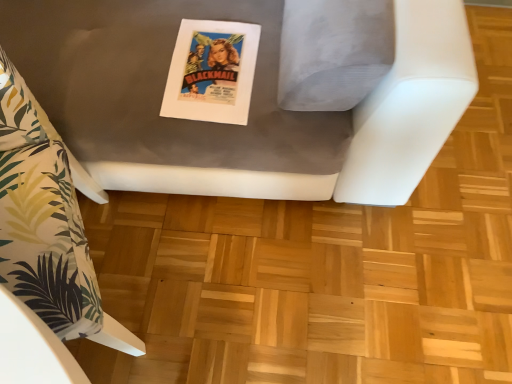
You are a GUI agent. You are given a task and a screenshot of the screen. Output one action in this format:
    pyautogui.click(x=<x>, y=<y>)
    Task: Click on the white fabric pillow at left, which is counted as the first furniture, starting from the left
    The width and height of the screenshot is (512, 384).
    Given the screenshot: What is the action you would take?
    pyautogui.click(x=44, y=250)

What do you see at coordinates (251, 102) in the screenshot?
I see `matte gray cushion at center, the 2th furniture in the left-to-right sequence` at bounding box center [251, 102].

What is the approximate width of matte gray cushion at center, which is counted as the 1th furniture, starting from the right?

matte gray cushion at center, which is counted as the 1th furniture, starting from the right, is 4.96 feet in width.

The width and height of the screenshot is (512, 384). I want to click on white fabric pillow at left, which is counted as the first furniture, starting from the left, so click(44, 250).

Would you say white fabric pillow at left, which is counted as the first furniture, starting from the left, is inside or outside matte gray cushion at center, the 2th furniture in the left-to-right sequence?

white fabric pillow at left, which is counted as the first furniture, starting from the left, fits inside matte gray cushion at center, the 2th furniture in the left-to-right sequence.

From the picture: Which of these two, white fabric pillow at left, which is counted as the first furniture, starting from the left, or matte gray cushion at center, the 2th furniture in the left-to-right sequence, is wider?

matte gray cushion at center, the 2th furniture in the left-to-right sequence.

From the image's perspective, which one is positioned higher, white fabric pillow at left, the second furniture from the right, or matte gray cushion at center, which is counted as the 1th furniture, starting from the right?

matte gray cushion at center, which is counted as the 1th furniture, starting from the right, appears higher in the image.

Which is more to the left, white fabric pillow at left, which is counted as the first furniture, starting from the left, or matte gray cushion at center, the 2th furniture in the left-to-right sequence?

white fabric pillow at left, which is counted as the first furniture, starting from the left.

Is white fabric pillow at left, which is counted as the first furniture, starting from the left, surrounded by matte gray cushion at center, the 2th furniture in the left-to-right sequence?

Yes, white fabric pillow at left, which is counted as the first furniture, starting from the left, is a part of matte gray cushion at center, the 2th furniture in the left-to-right sequence.

Considering the sizes of matte gray cushion at center, which is counted as the 1th furniture, starting from the right, and white fabric pillow at left, the second furniture from the right, in the image, is matte gray cushion at center, which is counted as the 1th furniture, starting from the right, wider or thinner than white fabric pillow at left, the second furniture from the right,?

Clearly, matte gray cushion at center, which is counted as the 1th furniture, starting from the right, has more width compared to white fabric pillow at left, the second furniture from the right.

How many degrees apart are the facing directions of matte gray cushion at center, the 2th furniture in the left-to-right sequence, and white fabric pillow at left, which is counted as the first furniture, starting from the left?

A: The angular difference between matte gray cushion at center, the 2th furniture in the left-to-right sequence, and white fabric pillow at left, which is counted as the first furniture, starting from the left, is 20.7 degrees.

Based on their positions, is matte gray cushion at center, the 2th furniture in the left-to-right sequence, located to the left or right of white fabric pillow at left, the second furniture from the right?

In the image, matte gray cushion at center, the 2th furniture in the left-to-right sequence, appears on the right side of white fabric pillow at left, the second furniture from the right.

Could you tell me if matte paper poster at center is turned towards white fabric pillow at left, which is counted as the first furniture, starting from the left?

No, matte paper poster at center is not aimed at white fabric pillow at left, which is counted as the first furniture, starting from the left.

Identify the location of the 1st furniture in front of the matte paper poster at center, starting your count from the anchor. The width and height of the screenshot is (512, 384). (44, 250).

How distant is matte paper poster at center from white fabric pillow at left, the second furniture from the right?

matte paper poster at center is 15.50 inches from white fabric pillow at left, the second furniture from the right.

Is matte paper poster at center located outside white fabric pillow at left, which is counted as the first furniture, starting from the left?

Yes, matte paper poster at center is not within white fabric pillow at left, which is counted as the first furniture, starting from the left.

Based on the photo, how different are the orientations of white fabric pillow at left, which is counted as the first furniture, starting from the left, and matte paper poster at center in degrees?

white fabric pillow at left, which is counted as the first furniture, starting from the left, and matte paper poster at center are facing 22.2 degrees away from each other.

Identify the location of comic book on the right of white fabric pillow at left, which is counted as the first furniture, starting from the left. The height and width of the screenshot is (384, 512). (212, 72).

From a real-world perspective, is white fabric pillow at left, which is counted as the first furniture, starting from the left, physically located above or below matte paper poster at center?

white fabric pillow at left, which is counted as the first furniture, starting from the left, is below matte paper poster at center.

I want to click on comic book behind the matte gray cushion at center, the 2th furniture in the left-to-right sequence, so click(212, 72).

Are matte gray cushion at center, which is counted as the 1th furniture, starting from the right, and matte paper poster at center located far from each other?

No.

Can you tell me how much matte gray cushion at center, which is counted as the 1th furniture, starting from the right, and matte paper poster at center differ in facing direction?

The facing directions of matte gray cushion at center, which is counted as the 1th furniture, starting from the right, and matte paper poster at center are 1.42 degrees apart.

From the picture: From the image's perspective, between matte gray cushion at center, which is counted as the 1th furniture, starting from the right, and matte paper poster at center, which one is located above?

matte gray cushion at center, which is counted as the 1th furniture, starting from the right, is shown above in the image.

Considering the positions of objects matte paper poster at center and matte gray cushion at center, which is counted as the 1th furniture, starting from the right, in the image provided, who is in front, matte paper poster at center or matte gray cushion at center, which is counted as the 1th furniture, starting from the right,?

matte gray cushion at center, which is counted as the 1th furniture, starting from the right, is in front.

Considering the sizes of objects matte paper poster at center and matte gray cushion at center, the 2th furniture in the left-to-right sequence, in the image provided, who is thinner, matte paper poster at center or matte gray cushion at center, the 2th furniture in the left-to-right sequence,?

matte paper poster at center.

From a real-world perspective, is matte paper poster at center positioned over matte gray cushion at center, the 2th furniture in the left-to-right sequence, based on gravity?

No.

Consider the image. Is matte paper poster at center looking in the opposite direction of matte gray cushion at center, which is counted as the 1th furniture, starting from the right?

Correct, matte paper poster at center is looking away from matte gray cushion at center, which is counted as the 1th furniture, starting from the right.

You are a GUI agent. You are given a task and a screenshot of the screen. Output one action in this format:
    pyautogui.click(x=<x>, y=<y>)
    Task: Click on the furniture on the left of matte gray cushion at center, which is counted as the 1th furniture, starting from the right
    
    Given the screenshot: What is the action you would take?
    pyautogui.click(x=44, y=250)

Locate an element on the screen. furniture that is behind the matte gray cushion at center, which is counted as the 1th furniture, starting from the right is located at coordinates 44,250.

Looking at this image, looking at the image, which one is located further to matte paper poster at center, matte gray cushion at center, which is counted as the 1th furniture, starting from the right, or white fabric pillow at left, which is counted as the first furniture, starting from the left?

Among the two, white fabric pillow at left, which is counted as the first furniture, starting from the left, is located further to matte paper poster at center.

Looking at the image, which one is located further to matte paper poster at center, white fabric pillow at left, the second furniture from the right, or matte gray cushion at center, the 2th furniture in the left-to-right sequence?

Based on the image, white fabric pillow at left, the second furniture from the right, appears to be further to matte paper poster at center.

Which object lies nearer to the anchor point matte gray cushion at center, which is counted as the 1th furniture, starting from the right, white fabric pillow at left, the second furniture from the right, or matte paper poster at center?

matte paper poster at center is positioned closer to the anchor matte gray cushion at center, which is counted as the 1th furniture, starting from the right.

Considering their positions, is matte paper poster at center positioned further to matte gray cushion at center, which is counted as the 1th furniture, starting from the right, than white fabric pillow at left, the second furniture from the right?

white fabric pillow at left, the second furniture from the right, is further to matte gray cushion at center, which is counted as the 1th furniture, starting from the right.

Looking at the image, which one is located closer to white fabric pillow at left, which is counted as the first furniture, starting from the left, matte gray cushion at center, the 2th furniture in the left-to-right sequence, or matte paper poster at center?

Based on the image, matte paper poster at center appears to be nearer to white fabric pillow at left, which is counted as the first furniture, starting from the left.

Looking at this image, looking at the image, which one is located closer to white fabric pillow at left, the second furniture from the right, matte paper poster at center or matte gray cushion at center, which is counted as the 1th furniture, starting from the right?

The object closer to white fabric pillow at left, the second furniture from the right, is matte paper poster at center.

Where is `furniture between matte gray cushion at center, the 2th furniture in the left-to-right sequence, and matte paper poster at center, along the z-axis`? The image size is (512, 384). furniture between matte gray cushion at center, the 2th furniture in the left-to-right sequence, and matte paper poster at center, along the z-axis is located at coordinates (44, 250).